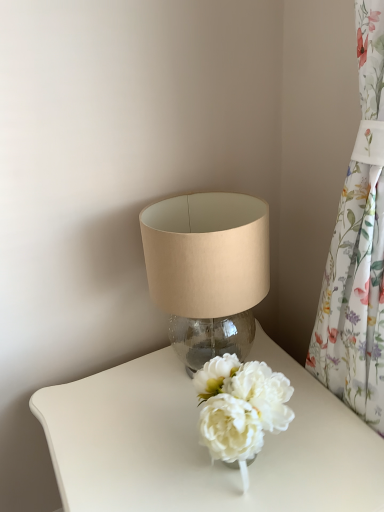
I want to click on free space in front of translucent glass lampshade at upper center, so click(193, 462).